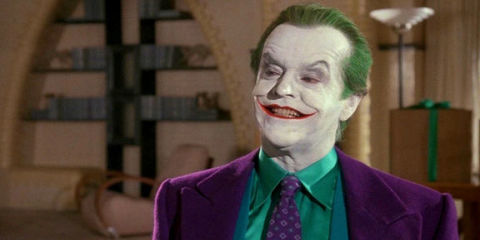
At what (x,y) coordinates should I click in order to perform the action: click on shelf. Please return your answer as a coordinate pair (x, y). Looking at the image, I should click on (61, 122), (84, 73), (89, 20), (169, 18), (174, 68), (184, 121).